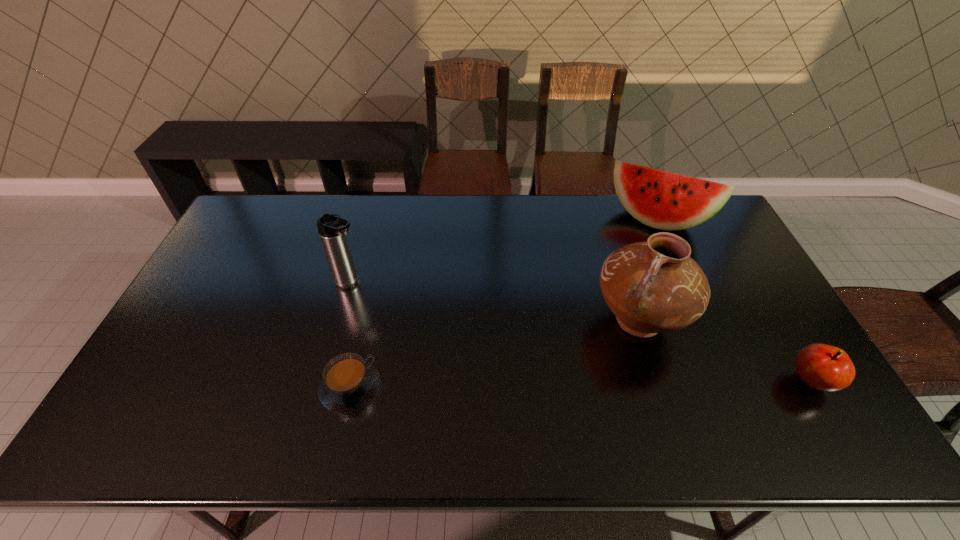
Locate an element on the screen. This screenshot has width=960, height=540. the shortest object is located at coordinates (349, 382).

Locate an element on the screen. the fourth tallest object is located at coordinates (823, 367).

You are a GUI agent. You are given a task and a screenshot of the screen. Output one action in this format:
    pyautogui.click(x=<x>, y=<y>)
    Task: Click on the thermos bottle
    The image size is (960, 540).
    Given the screenshot: What is the action you would take?
    pyautogui.click(x=332, y=229)

You are a GUI agent. You are given a task and a screenshot of the screen. Output one action in this format:
    pyautogui.click(x=<x>, y=<y>)
    Task: Click on the third shortest object
    
    Given the screenshot: What is the action you would take?
    click(663, 200)

Where is `the farthest object`? Image resolution: width=960 pixels, height=540 pixels. the farthest object is located at coordinates (663, 200).

Find the location of a particular element. pottery is located at coordinates (652, 287).

This screenshot has width=960, height=540. What are the coordinates of `vacant space located on the right of the shortest object` in the screenshot? It's located at (417, 388).

Locate an element on the screen. This screenshot has width=960, height=540. vacant space situated on the back of the fourth tallest object is located at coordinates (786, 340).

Where is `free space located 0.100m on the handle side of the thermos bottle`? free space located 0.100m on the handle side of the thermos bottle is located at coordinates (388, 302).

Where is `vacant space located on the handle side of the thermos bottle`? Image resolution: width=960 pixels, height=540 pixels. vacant space located on the handle side of the thermos bottle is located at coordinates (378, 297).